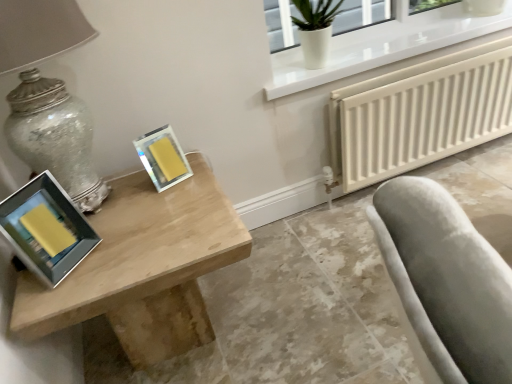
In order to click on vacant area that lies to the right of yellow matte picture frame at upper center, which is the first picture frame from back to front in this screenshot , I will do `click(201, 178)`.